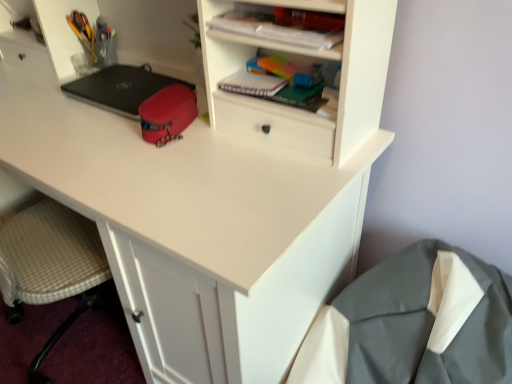
Find the location of a particular element. The height and width of the screenshot is (384, 512). empty space that is ontop of black matte laptop at center (from a real-world perspective) is located at coordinates (112, 81).